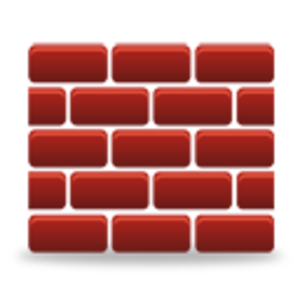
Where is `white grout`? The width and height of the screenshot is (300, 300). white grout is located at coordinates (108, 166), (110, 128), (149, 92), (238, 127), (236, 207).